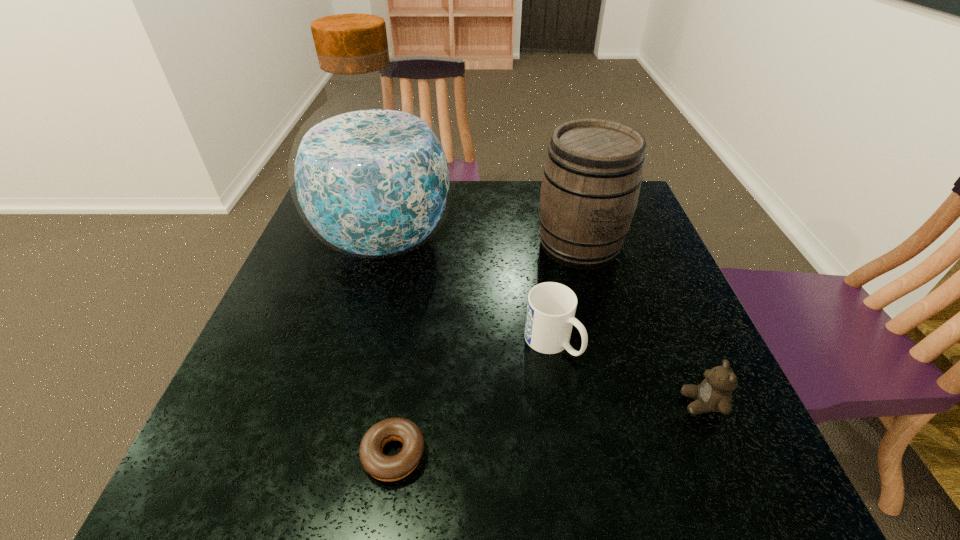
Identify the location of free spot located 0.190m on the face of the teddy bear. The width and height of the screenshot is (960, 540). (581, 403).

You are a GUI agent. You are given a task and a screenshot of the screen. Output one action in this format:
    pyautogui.click(x=<x>, y=<y>)
    Task: Click on the vacant area situated on the back of the shortest object
    The height and width of the screenshot is (540, 960).
    Given the screenshot: What is the action you would take?
    pyautogui.click(x=410, y=351)

Locate an element on the screen. water jug that is at the far edge is located at coordinates (371, 175).

Where is `wine bucket that is at the far edge`? The height and width of the screenshot is (540, 960). wine bucket that is at the far edge is located at coordinates (592, 176).

Where is `object positioned at the near edge`? This screenshot has height=540, width=960. object positioned at the near edge is located at coordinates (386, 468).

This screenshot has height=540, width=960. I want to click on object present at the left edge, so click(371, 175).

Image resolution: width=960 pixels, height=540 pixels. I want to click on wine bucket located in the right edge section of the desktop, so click(x=592, y=176).

What are the coordinates of `teddy bear that is at the right edge` in the screenshot? It's located at (714, 394).

This screenshot has width=960, height=540. Find the location of `object that is positioned at the far left corner`. object that is positioned at the far left corner is located at coordinates (371, 175).

The height and width of the screenshot is (540, 960). Identify the location of object that is at the far right corner. (592, 176).